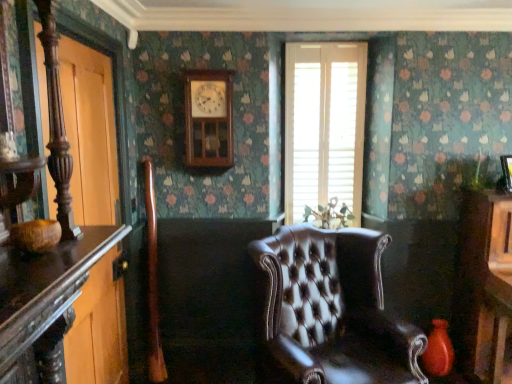
Find the location of `vacant point above white wood blinds at center (from a real-world perspective)`. vacant point above white wood blinds at center (from a real-world perspective) is located at coordinates (331, 48).